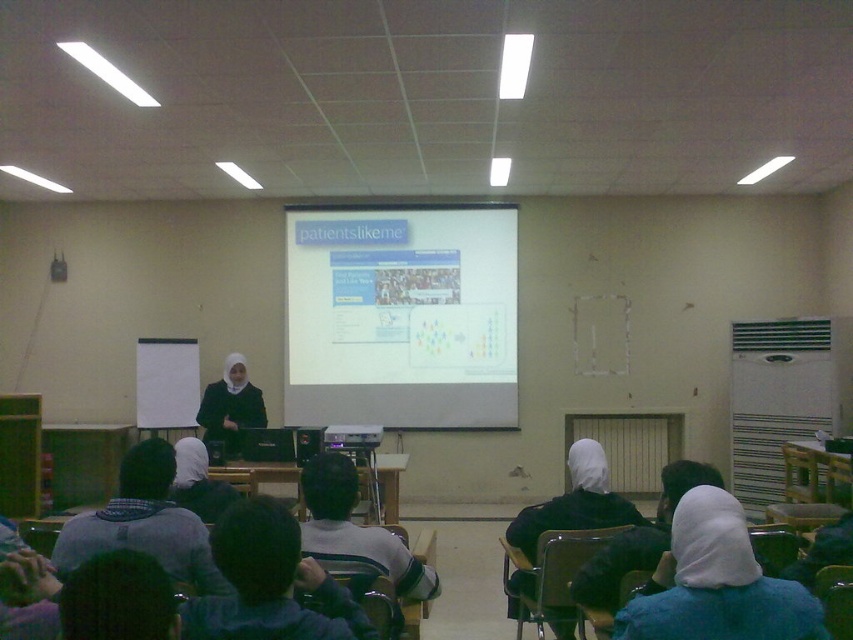
Is white matte hijab at lower right shorter than matte black hijab at center?

Yes.

Who is taller, white matte hijab at lower right or matte black hijab at center?

matte black hijab at center

In order to click on white matte hijab at lower right in this screenshot , I will do `click(717, 582)`.

Is white matte projection screen at center below gray knitted sweater at lower left?

Incorrect, white matte projection screen at center is not positioned below gray knitted sweater at lower left.

Does white matte projection screen at center have a lesser width compared to gray knitted sweater at lower left?

In fact, white matte projection screen at center might be wider than gray knitted sweater at lower left.

Does point (497, 301) come behind point (148, 452)?

That is True.

At what (x,y) coordinates should I click in order to perform the action: click on white matte projection screen at center. Please return your answer as a coordinate pair (x, y). This screenshot has width=853, height=640. Looking at the image, I should click on (401, 316).

Between white matte projection screen at center and matte black hijab at center, which one appears on the left side from the viewer's perspective?

matte black hijab at center

Which is below, white matte projection screen at center or matte black hijab at center?

matte black hijab at center is lower down.

Between point (325, 321) and point (228, 390), which one is positioned behind?

Positioned behind is point (325, 321).

The height and width of the screenshot is (640, 853). I want to click on white matte projection screen at center, so click(401, 316).